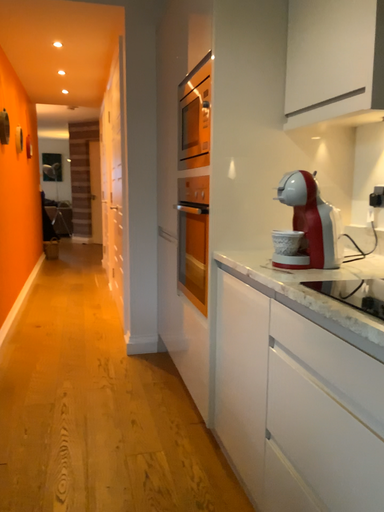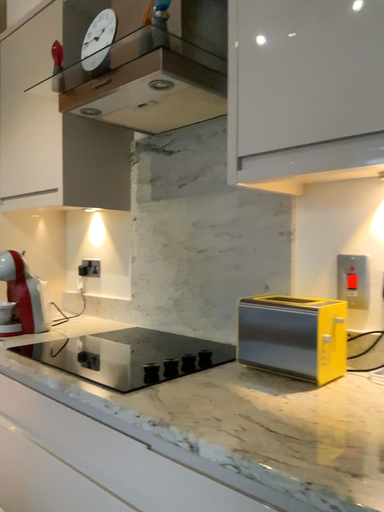
Question: How did the camera likely rotate when shooting the video?

Choices:
 (A) rotated right
 (B) rotated left

Answer: (A)